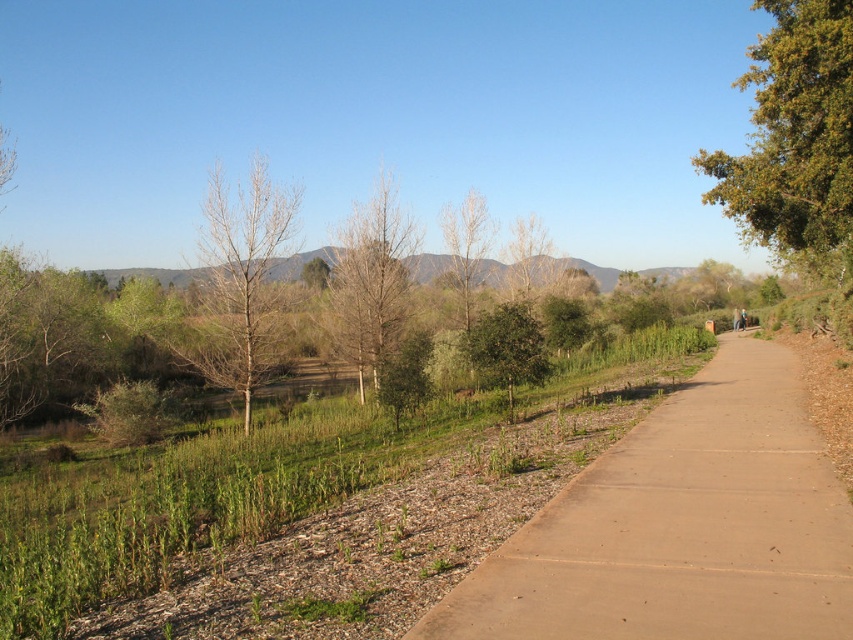
You are a hiker standing at the start of the trail and want to take a photo of the green leafy tree at center. To get the best shot, should you stand to the left or right of the brown concrete path at center?

You should stand to the right of the brown concrete path at center because the green leafy tree at center is on the right side of the path, allowing for a clear view without obstruction.

You are a gardener planning to plant a new tree in this outdoor area. The brown matte tree at center and the green leafy tree at center are already present. Which existing tree has a wider trunk to consider spacing requirements?

The brown matte tree at center has a wider trunk than the green leafy tree at center, so it requires more space.

You are standing at the point marked as point (387, 291) and want to walk to the other end of the path. If your walking speed is 1.5 meters per second, how many seconds will it take you to reach the end?

The distance between the two points is 26.19 meters. At a speed of 1.5 meters per second, it will take 26.19 divided by 1.5, which equals approximately 17.46 seconds. So, it will take about 17.5 seconds to reach the end.